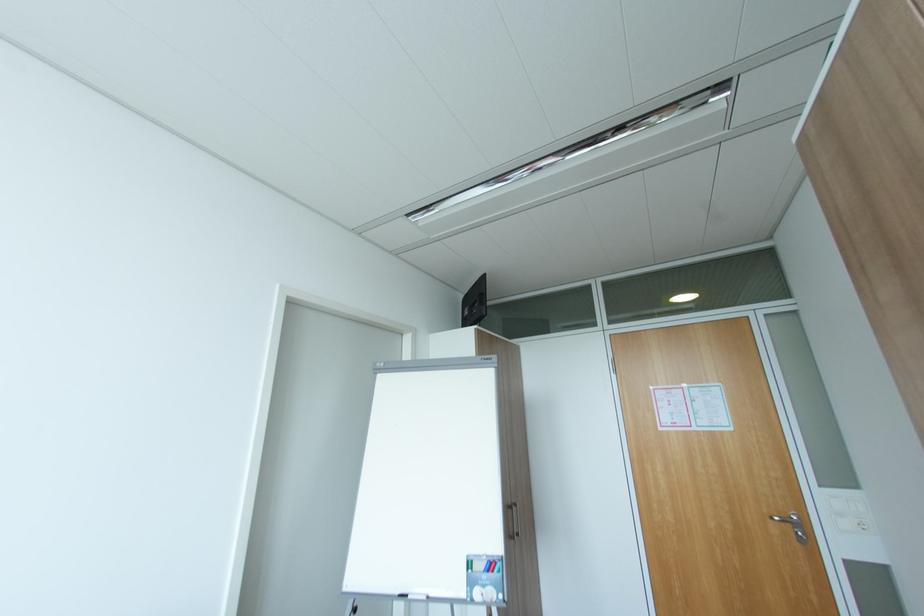
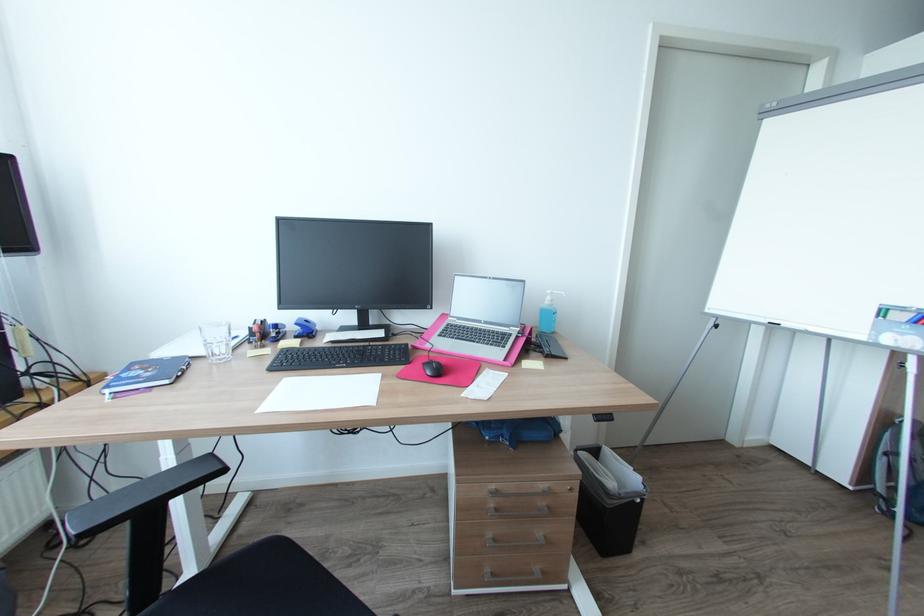
Where in the second image is the point corresponding to pixel 349 589 from the first image?

(712, 310)